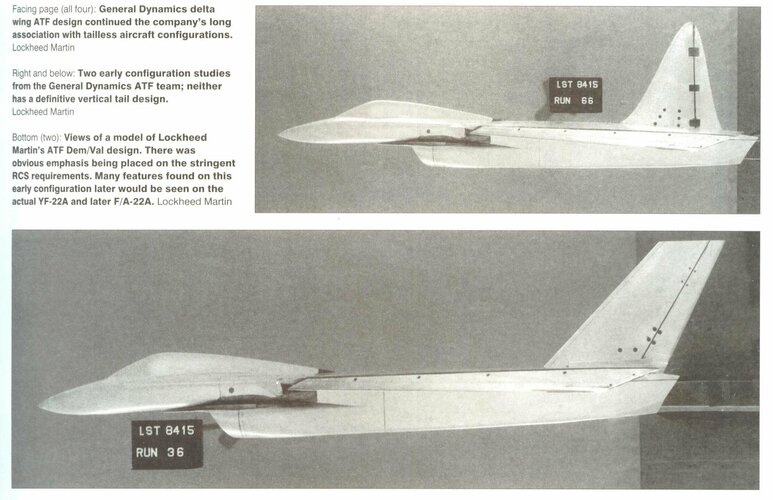
Find the location of `wall`. wall is located at coordinates (305, 56).